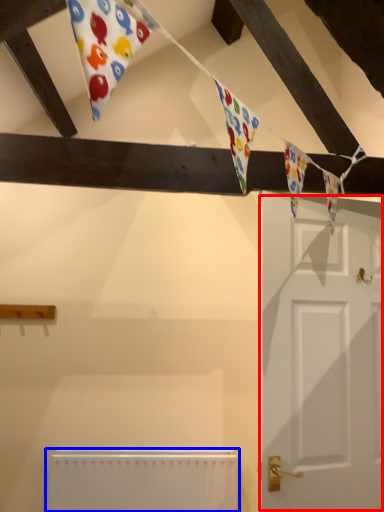
Question: Among these objects, which one is nearest to the camera, door (highlighted by a red box) or radiator (highlighted by a blue box)?

Choices:
 (A) door
 (B) radiator

Answer: (A)